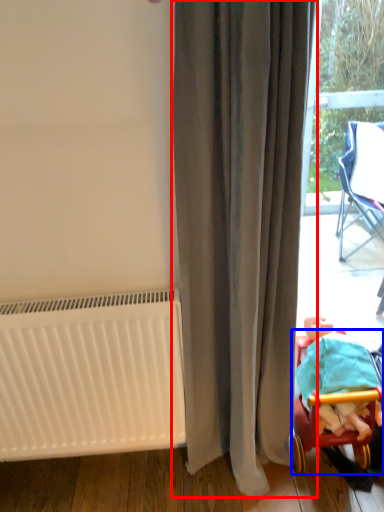
Question: Which of the following is the closest to the observer, curtain (highlighted by a red box) or furniture (highlighted by a blue box)?

Choices:
 (A) curtain
 (B) furniture

Answer: (A)